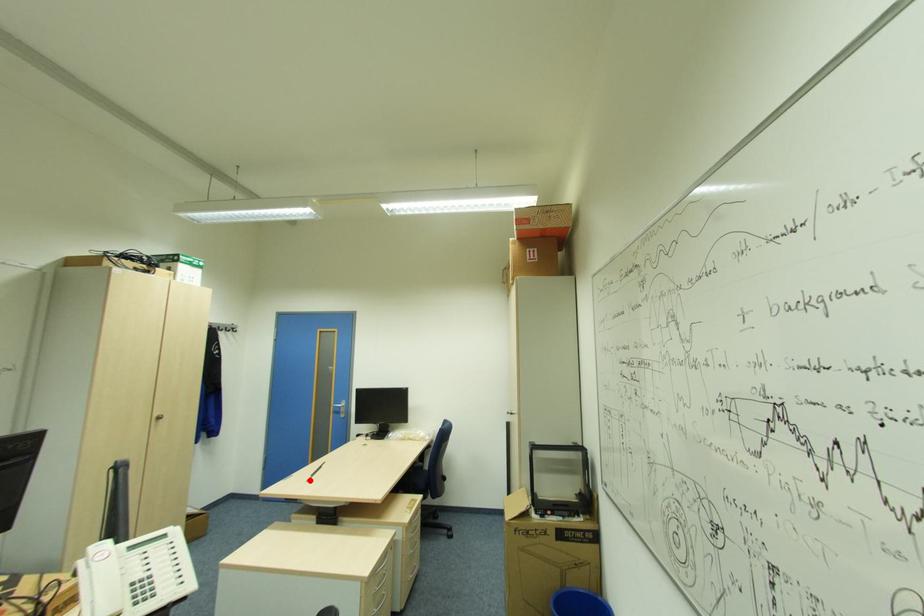
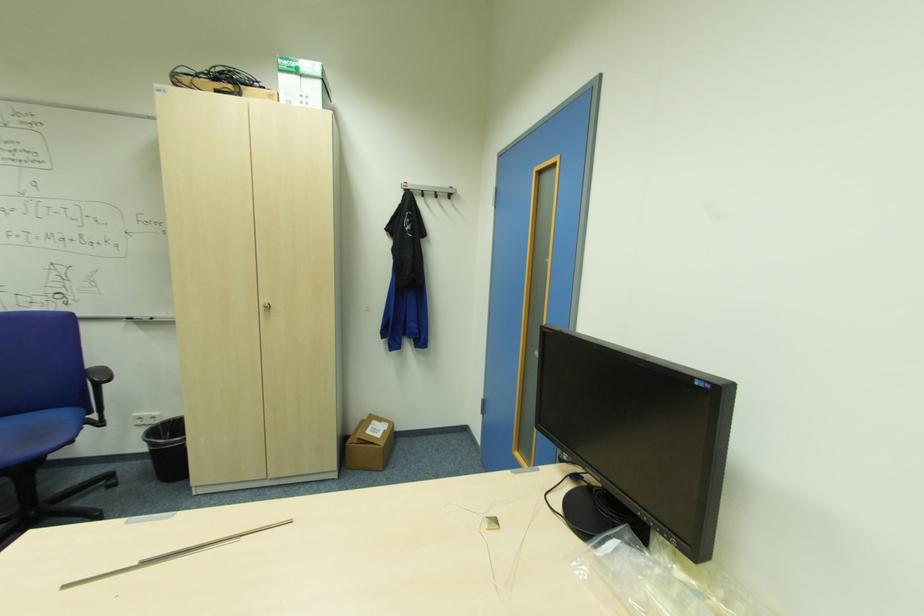
The point at the highlighted location is marked in the first image. Where is the corresponding point in the second image?

(63, 589)